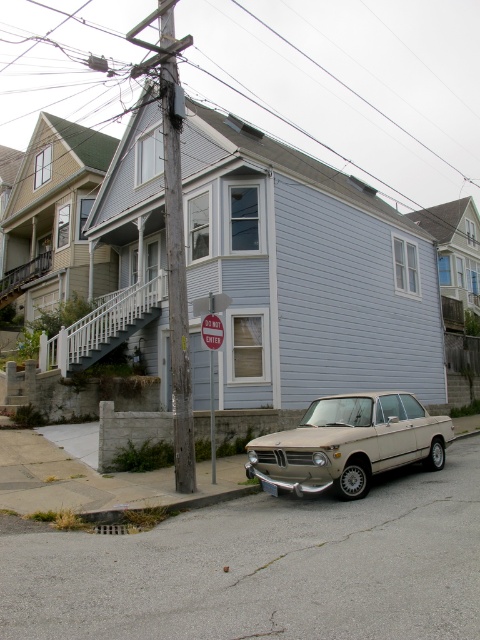
You are standing at the front door of the house and want to move to the beige matte sedan at center. Which direction should you walk to reach the car?

Since the beige matte sedan at center is located at point (x=348, y=444) in the image, you should walk forward and to the right to reach it.

You are a pedestrian standing at the edge of the street. You see a beige matte sedan at center and a wooden utility pole at center. Which object is nearer to you?

The beige matte sedan at center is closer to the viewer than the wooden utility pole at center.

You are a delivery person standing at the front door of the house. You need to place a package on the metallic wire at upper center and the beige matte sedan at center. Which object is closer to you?

The metallic wire at upper center is closer to you because it is only 126.53 meters away from the beige matte sedan at center, so the metallic wire is nearer than the sedan.